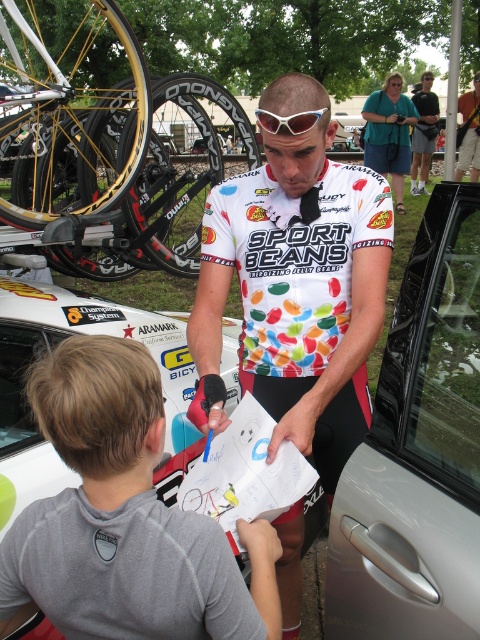
Question: Which is farther from the silver metallic car door at right?

Choices:
 (A) white glossy jersey at center
 (B) blue-green fabric purse at upper center
 (C) gray fabric shirt at lower left
 (D) matte black shirt at upper center

Answer: (D)

Question: Which is farther from the gray fabric shirt at lower left?

Choices:
 (A) blue-green fabric purse at upper center
 (B) gold wire-spoke wheel at upper left
 (C) matte black shirt at upper center

Answer: (C)

Question: Is gold wire-spoke wheel at upper left smaller than white glossy jersey at center?

Choices:
 (A) no
 (B) yes

Answer: (A)

Question: Does white jersey at center have a smaller size compared to white plastic goggles at center?

Choices:
 (A) yes
 (B) no

Answer: (B)

Question: In this image, where is gold wire-spoke wheel at upper left located relative to white plastic goggles at center?

Choices:
 (A) left
 (B) right

Answer: (A)

Question: Among these objects, which one is farthest from the camera?

Choices:
 (A) gray fabric shirt at lower left
 (B) silver metallic car door at right
 (C) white jersey at center
 (D) blue-green fabric purse at upper center

Answer: (D)